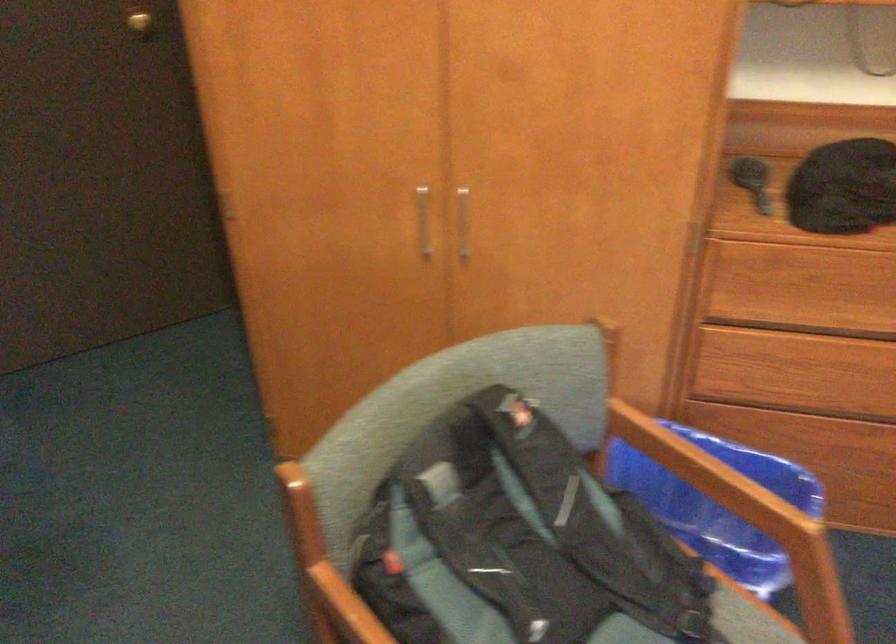
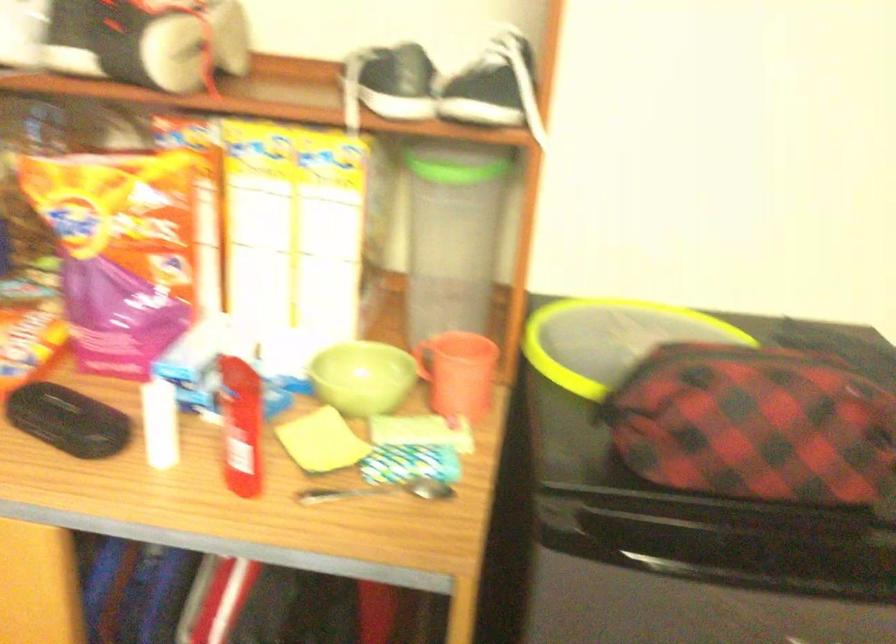
Question: Based on the continuous images, in which direction is the camera rotating? Reply with the corresponding letter.

Choices:
 (A) Left
 (B) Right
 (C) Up
 (D) Down

Answer: (A)